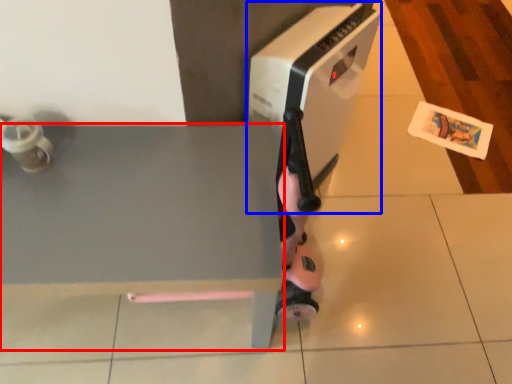
Question: Which object appears farthest to the camera in this image, table (highlighted by a red box) or home appliance (highlighted by a blue box)?

Choices:
 (A) table
 (B) home appliance

Answer: (B)